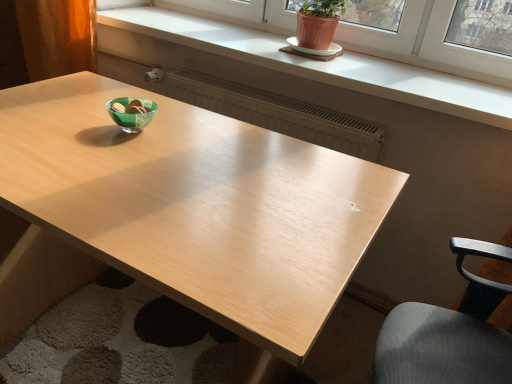
Question: From a real-world perspective, relative to white ceramic saucer at upper center, is matte white window sill at upper center vertically above or below?

Choices:
 (A) above
 (B) below

Answer: (B)

Question: From their relative heights in the image, would you say matte white window sill at upper center is taller or shorter than white ceramic saucer at upper center?

Choices:
 (A) tall
 (B) short

Answer: (A)

Question: Considering the real-world distances, which object is closest to the light wood table at center?

Choices:
 (A) white ceramic saucer at upper center
 (B) matte white window sill at upper center
 (C) matte brown curtain at left

Answer: (C)

Question: Which object is positioned farthest from the white ceramic saucer at upper center?

Choices:
 (A) matte brown curtain at left
 (B) light wood table at center
 (C) matte white window sill at upper center

Answer: (A)